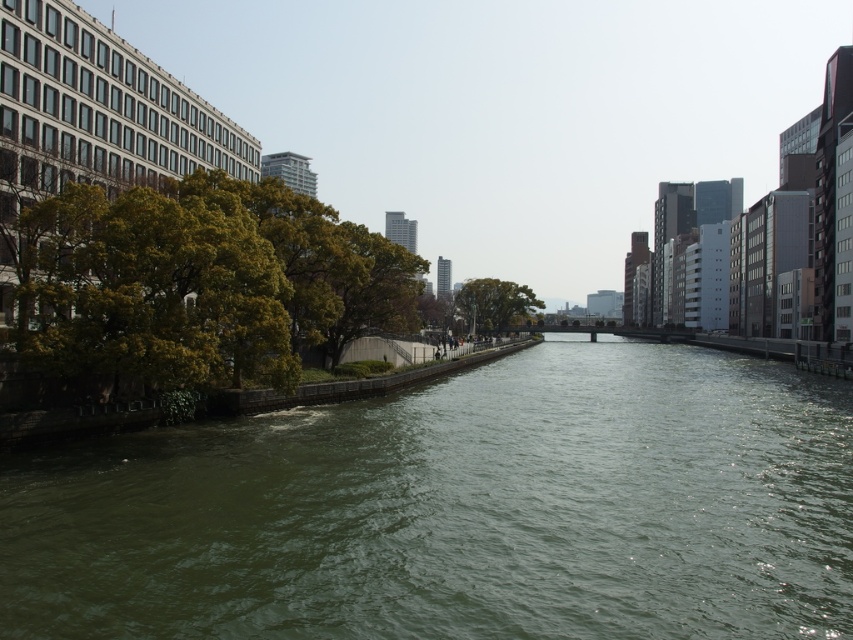
You are standing at the origin point of the coordinate system in the urban river scene. There is a green water at center located at point (457, 509). Can you tell me the coordinates of the green water at center?

The coordinates of the green water at center are point (457, 509).

You are standing at the embankment on the left side of the river and want to walk towards the point labeled point (99, 316). Which direction should you move relative to point (763, 445)?

To reach point (99, 316) from the embankment, you should move away from point (763, 445) since it is closer to you than point (99, 316).